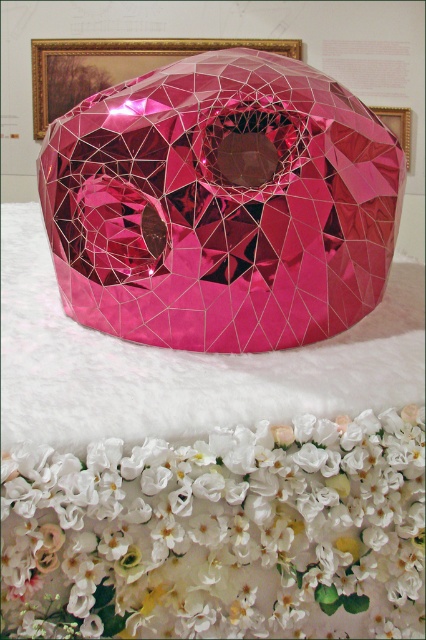
You are an interior designer planning to place a rectangular table that is 1.2 meters wide in the space between the shiny pink crystal at center and the white silk flowers at center. Based on the scene, can the table fit between them?

The shiny pink crystal at center is wider than the white silk flowers at center. Since the table is 1.2 meters wide, the space between them may or may not accommodate it depending on the total available width. However, without specific distance measurements between the objects, it is impossible to determine if the table will fit.

You are an interior designer planning to place a small vase on the white fluffy surface near the shiny pink crystal at center. To ensure it doesn not block the view of the crystal, where should you place the vase relative to the crystal?

The shiny pink crystal at center is located at point (221, 205). Since the vase needs to be placed on the white fluffy surface without blocking the view of the crystal, you should position the vase either to the left or right of the crystal, ensuring it is not directly in front or behind it.

You are holding a small toy that is 12 inches long and want to place it between you and the shiny pink crystal at center. Can the toy fit in the space between you and the crystal?

The distance between you and the shiny pink crystal at center is 31.20 inches. Since the toy is only 12 inches long, it can easily fit in the space between you and the crystal.